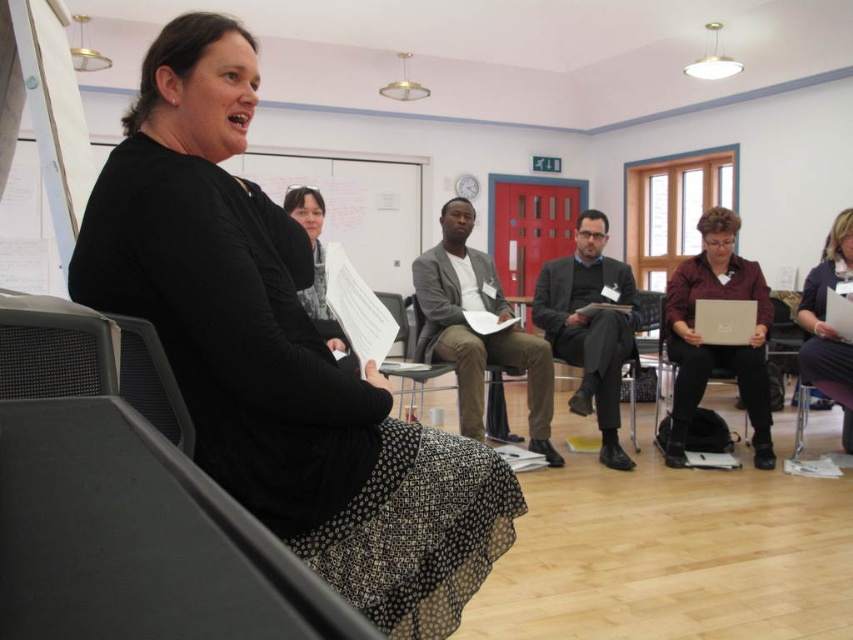
From the picture: You are attending a meeting in this room and need to pass a document to the person sitting at the center. The gray fabric suit at center and the white matte laptop at center are in your way. Which object should you move to the right to create space?

You should move the gray fabric suit at center to the right since it is located to the left of the white matte laptop at center, allowing you to create space by shifting it towards the laptop.

You are organizing a presentation and need to place a white matte laptop at center on a table. However, there is already a gray fabric suit at center occupying the space. Can the laptop be placed on the table without moving the suit?

The gray fabric suit at center is much taller than the white matte laptop at center. Since the suit is taller, placing the laptop on the table might be difficult due to the space it occupies vertically. You may need to adjust the position or remove the suit to accommodate the laptop properly.

You are standing in the room and see the point marked at coordinates [277,353]. What object is located at this position?

The point at coordinates [277,353] corresponds to the black textured dress at left.